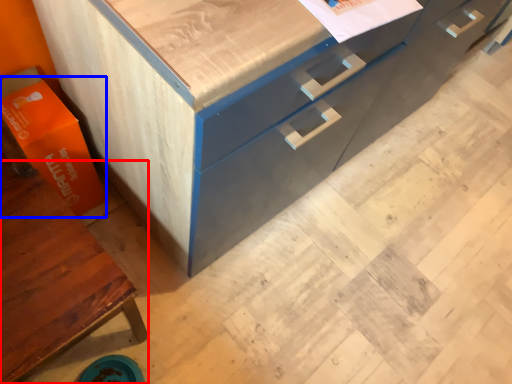
Question: Which point is closer to the camera, cabinetry (highlighted by a red box) or cardboard box (highlighted by a blue box)?

Choices:
 (A) cabinetry
 (B) cardboard box

Answer: (A)